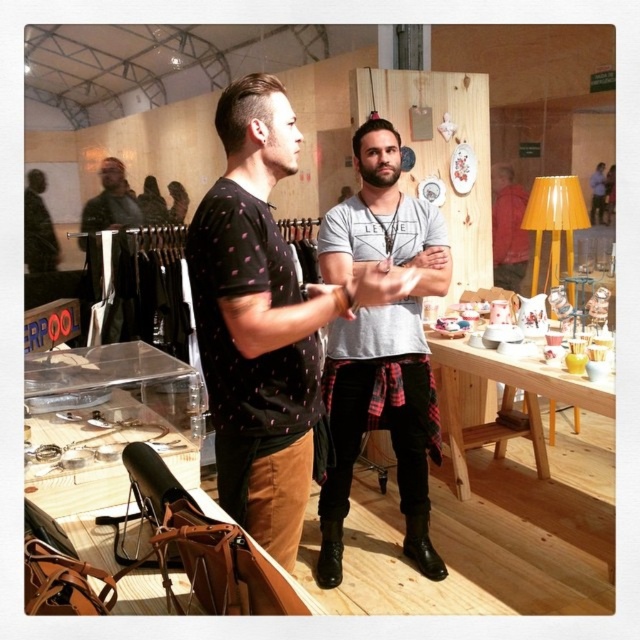
Which is behind, point (298, 392) or point (445, 236)?

Point (445, 236)

The width and height of the screenshot is (640, 640). Describe the element at coordinates (264, 321) in the screenshot. I see `black dotted t-shirt at center` at that location.

Find the location of a particular element. black dotted t-shirt at center is located at coordinates (264, 321).